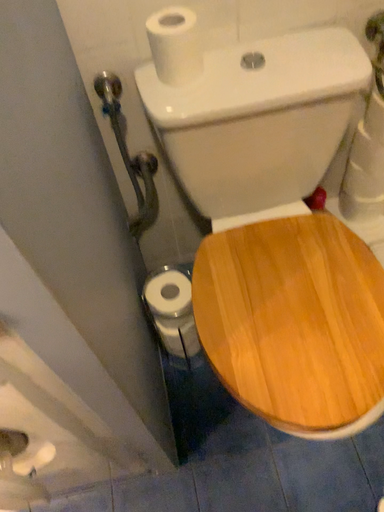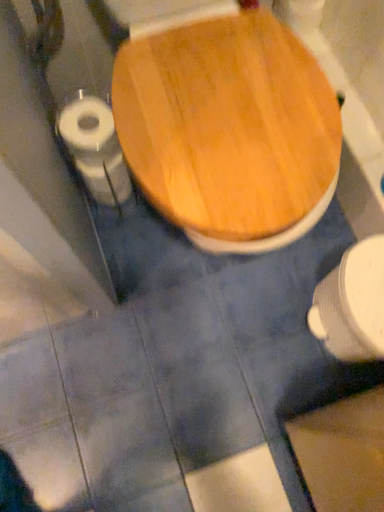
Question: Which way did the camera rotate in the video?

Choices:
 (A) rotated right
 (B) rotated left

Answer: (A)